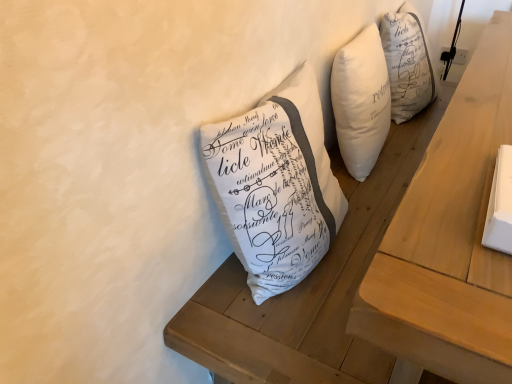
Question: Does white fabric pillow at center have a lesser width compared to wooden table at center?

Choices:
 (A) yes
 (B) no

Answer: (B)

Question: Is white fabric pillow at center positioned behind wooden table at center?

Choices:
 (A) yes
 (B) no

Answer: (A)

Question: Is white fabric pillow at center taller than wooden table at center?

Choices:
 (A) yes
 (B) no

Answer: (A)

Question: Is white fabric pillow at center located outside wooden table at center?

Choices:
 (A) no
 (B) yes

Answer: (A)

Question: Is white fabric pillow at center wider than wooden table at center?

Choices:
 (A) yes
 (B) no

Answer: (A)

Question: Is white fabric pillow at center with wooden table at center?

Choices:
 (A) no
 (B) yes

Answer: (A)

Question: Does wooden table at center have a greater height compared to white fabric pillow at center?

Choices:
 (A) yes
 (B) no

Answer: (B)

Question: Is white fabric pillow at center a part of wooden table at center?

Choices:
 (A) no
 (B) yes

Answer: (B)

Question: Is white fabric pillow at center at the back of wooden table at center?

Choices:
 (A) no
 (B) yes

Answer: (B)

Question: Is wooden table at center far from white fabric pillow at center?

Choices:
 (A) no
 (B) yes

Answer: (A)

Question: From a real-world perspective, is wooden table at center physically below white fabric pillow at center?

Choices:
 (A) yes
 (B) no

Answer: (A)

Question: Is wooden table at center not within white fabric pillow at center?

Choices:
 (A) no
 (B) yes

Answer: (B)

Question: Is point (488, 64) positioned closer to the camera than point (460, 104)?

Choices:
 (A) farther
 (B) closer

Answer: (A)